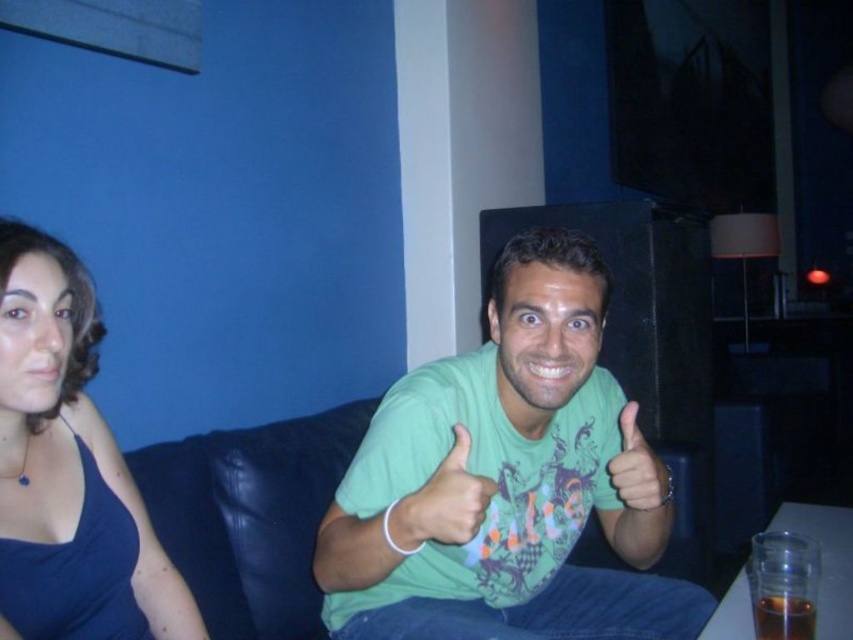
Is green matte hand at center thinner than matte green hand at center?

Yes, green matte hand at center is thinner than matte green hand at center.

Describe the element at coordinates (440, 502) in the screenshot. This screenshot has height=640, width=853. I see `green matte hand at center` at that location.

This screenshot has height=640, width=853. What are the coordinates of `green matte hand at center` in the screenshot? It's located at (440, 502).

This screenshot has width=853, height=640. I want to click on satin blue dress at left, so click(x=68, y=468).

From the picture: Between satin blue dress at left and matte green hand at center, which one has less height?

Standing shorter between the two is matte green hand at center.

At what (x,y) coordinates should I click in order to perform the action: click on satin blue dress at left. Please return your answer as a coordinate pair (x, y). Looking at the image, I should click on (68, 468).

Image resolution: width=853 pixels, height=640 pixels. What do you see at coordinates (440, 502) in the screenshot? I see `green matte hand at center` at bounding box center [440, 502].

Consider the image. Can you confirm if green matte hand at center is taller than translucent glass at lower right?

Correct, green matte hand at center is much taller as translucent glass at lower right.

Is point (447, 456) closer to viewer compared to point (781, 614)?

Yes, it is.

Find the location of a particular element. Image resolution: width=853 pixels, height=640 pixels. green matte hand at center is located at coordinates (440, 502).